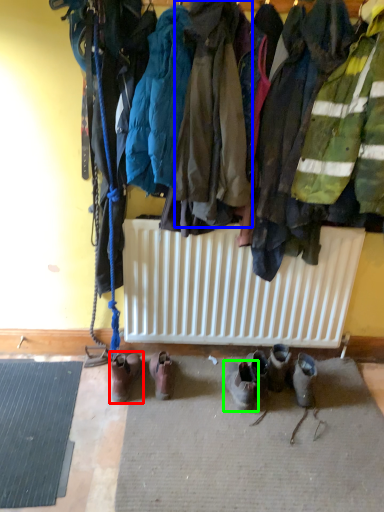
Question: Based on their relative distances, which object is farther from footwear (highlighted by a red box)? Choose from jacket (highlighted by a blue box) and footwear (highlighted by a green box).

Choices:
 (A) jacket
 (B) footwear

Answer: (A)